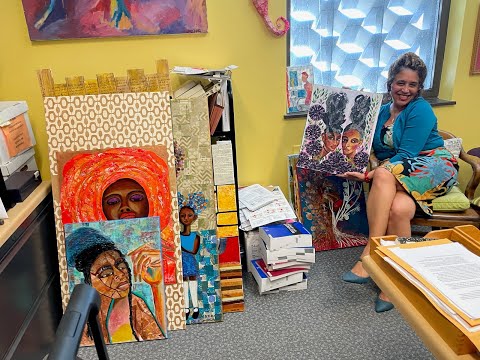
You are a GUI agent. You are given a task and a screenshot of the screen. Output one action in this format:
    pyautogui.click(x=<x>, y=<y>)
    Task: Click on the yellow wall
    The height and width of the screenshot is (360, 480).
    Given the screenshot: What is the action you would take?
    pyautogui.click(x=258, y=94)